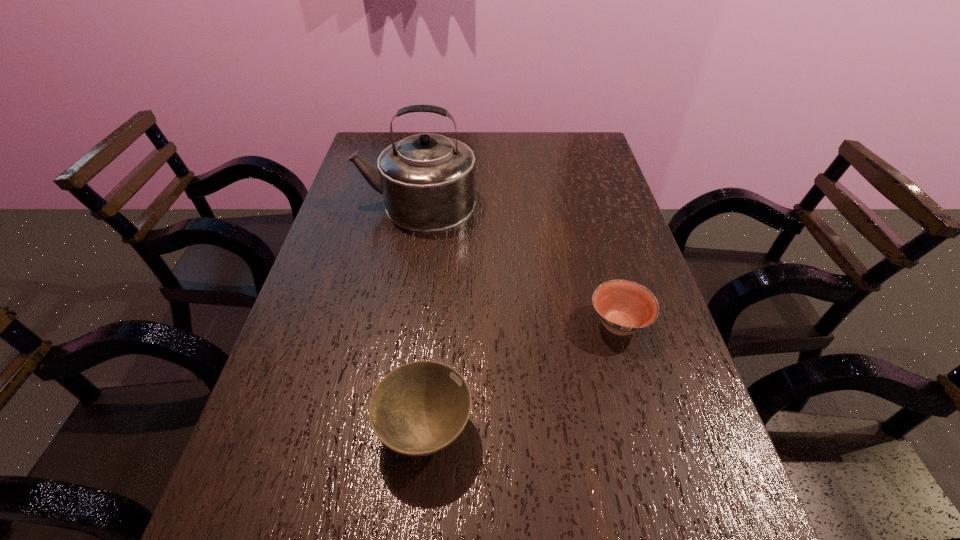
You are a GUI agent. You are given a task and a screenshot of the screen. Output one action in this format:
    pyautogui.click(x=<x>, y=<y>)
    Task: Click on the free location at the far edge
    
    Given the screenshot: What is the action you would take?
    pyautogui.click(x=498, y=146)

This screenshot has width=960, height=540. In order to click on free space at the left edge of the desktop in this screenshot , I will do `click(335, 363)`.

The height and width of the screenshot is (540, 960). Identify the location of blank space at the right edge of the desktop. (635, 258).

Locate an element on the screen. The width and height of the screenshot is (960, 540). vacant position at the far right corner of the desktop is located at coordinates (561, 152).

In order to click on vacant space in between the shorter bowl and the tallest object in this screenshot , I will do `click(517, 264)`.

This screenshot has width=960, height=540. In order to click on free point between the farther bowl and the nearer bowl in this screenshot , I will do `click(521, 377)`.

At what (x,y) coordinates should I click in order to perform the action: click on empty space that is in between the kettle and the left bowl. Please return your answer as a coordinate pair (x, y). Looking at the image, I should click on (420, 316).

Find the location of `vacant area that lies between the left bowl and the kettle`. vacant area that lies between the left bowl and the kettle is located at coordinates (420, 316).

Identify the location of free spot between the farthest object and the second tallest object. (420, 316).

The image size is (960, 540). I want to click on empty space between the taller bowl and the kettle, so coord(420,316).